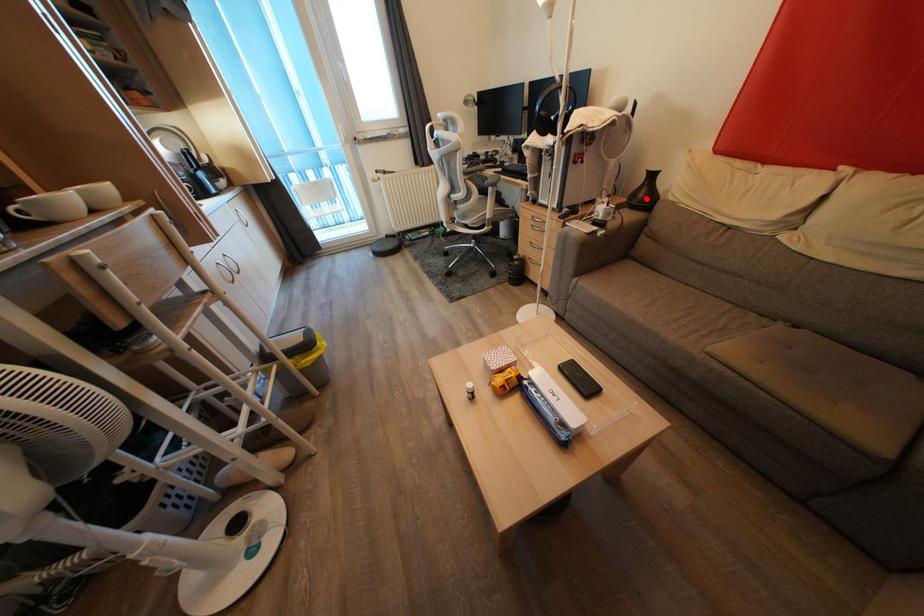
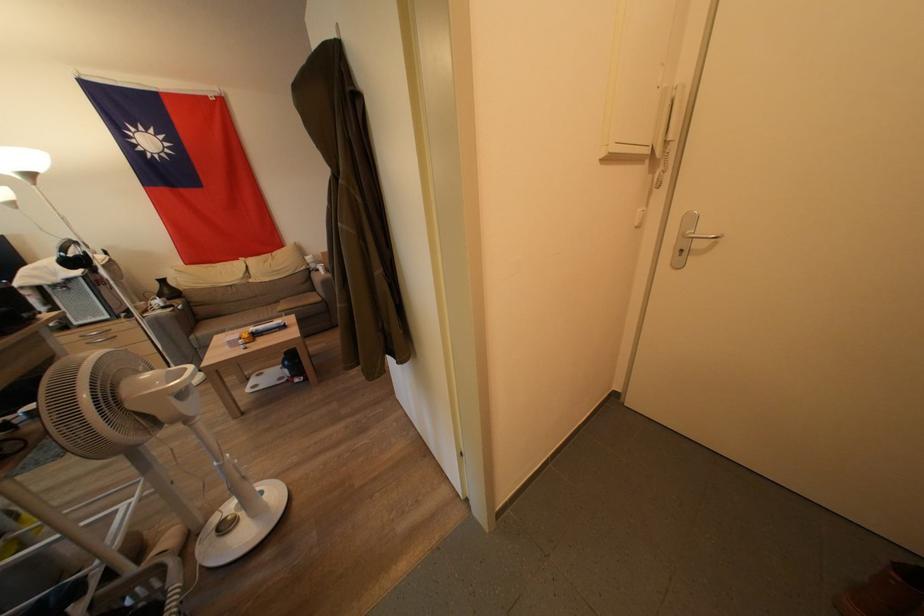
Question: I am providing you with two images of the same scene from different viewpoints. A red point is shown in image1. For the corresponding object point in image2, is it positioned nearer or farther from the camera?

Choices:
 (A) Nearer
 (B) Farther

Answer: (B)